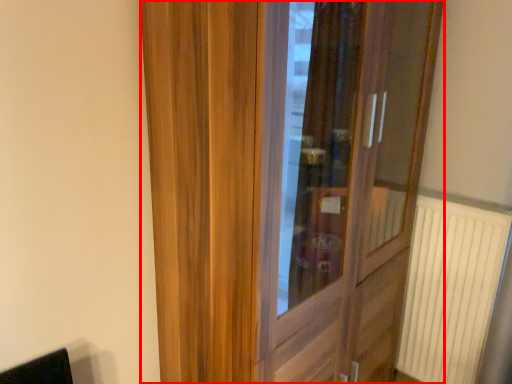
Question: Considering the relative positions of door (annotated by the red box) and radiator in the image provided, where is door (annotated by the red box) located with respect to the staircase?

Choices:
 (A) left
 (B) right

Answer: (A)